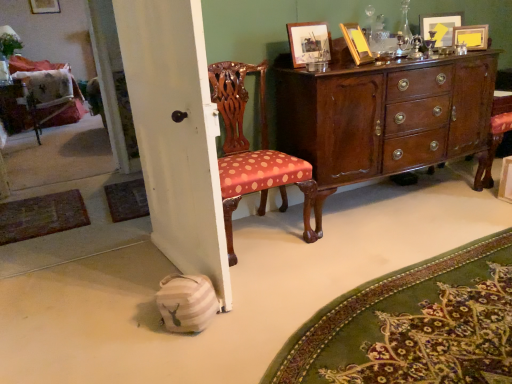
Where is `vacant area that lies between woven brown mat at lower left, which is the third mat from front to back, and green felt mat at lower left, the 1th mat when ordered from left to right`? This screenshot has width=512, height=384. vacant area that lies between woven brown mat at lower left, which is the third mat from front to back, and green felt mat at lower left, the 1th mat when ordered from left to right is located at coordinates (84, 206).